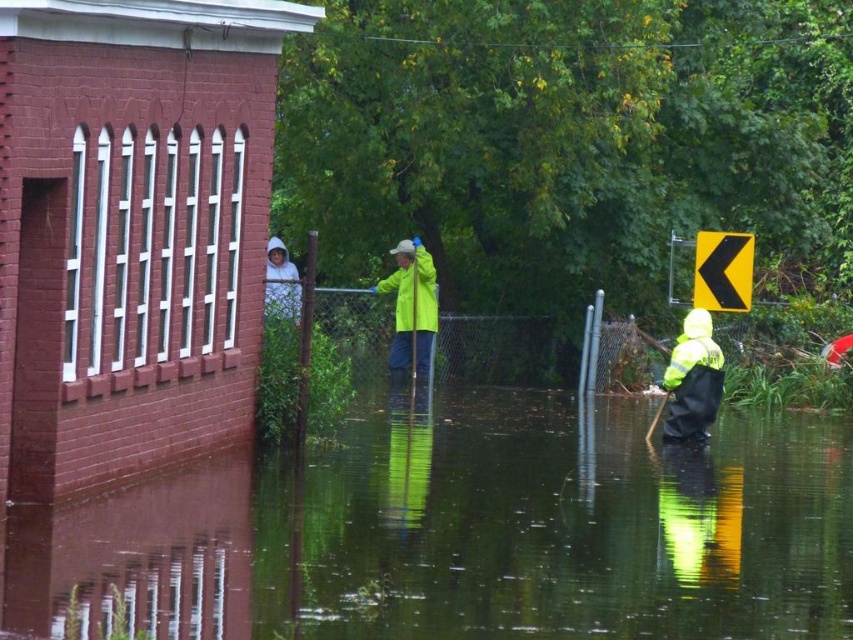
You are a rescue worker assessing the scene. You see the yellow reflective plastic at upper right and the white hooded sweatshirt at upper center. Which object is closer to you?

The yellow reflective plastic at upper right is closer to you because it is further to the viewer than the white hooded sweatshirt at upper center.

You are a rescue worker trying to locate two people in a flooded area. You see a reflective yellow raincoat at center and a neon yellow raincoat at center. Which one is positioned more to the left?

The neon yellow raincoat at center is positioned more to the left because the reflective yellow raincoat at center is to the right of it.

In the scene shown: You are a rescue worker trying to locate two items in the image. Which one is positioned to the right of the other between the yellow reflective plastic at upper right and the white hooded sweatshirt at upper center?

The yellow reflective plastic at upper right is positioned to the right of the white hooded sweatshirt at upper center.